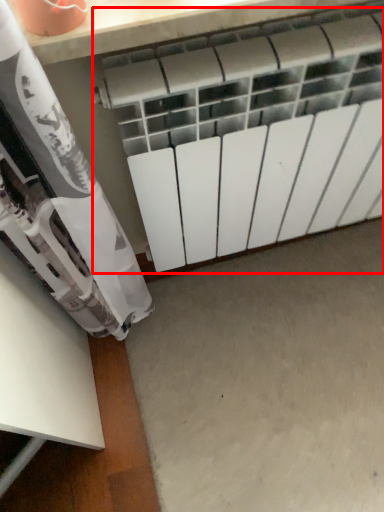
Question: From the image's perspective, what is the correct spatial relationship of radiator (annotated by the red box) in relation to concrete?

Choices:
 (A) above
 (B) below

Answer: (A)